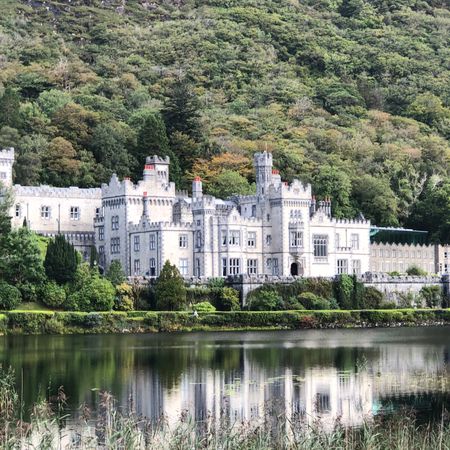
In order to click on wall in this screenshot , I will do `click(396, 285)`, `click(254, 287)`.